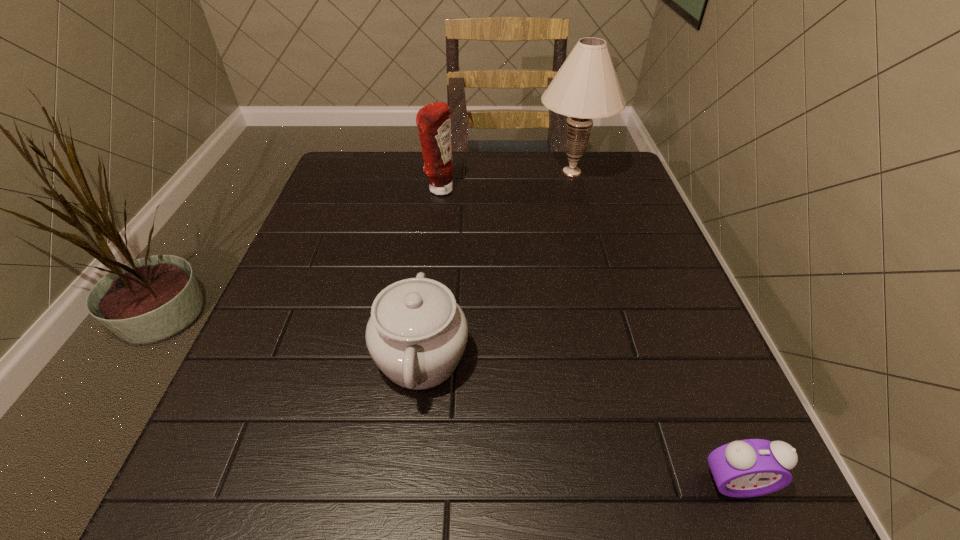
Locate an element on the screen. The height and width of the screenshot is (540, 960). the tallest object is located at coordinates (586, 87).

Find the location of a particular element. The height and width of the screenshot is (540, 960). condiment is located at coordinates (433, 120).

Image resolution: width=960 pixels, height=540 pixels. Find the location of `the second nearest object`. the second nearest object is located at coordinates (417, 333).

Find the location of a particular element. The height and width of the screenshot is (540, 960). chinaware is located at coordinates (417, 333).

Find the location of a particular element. the nearest object is located at coordinates (752, 467).

At what (x,y) coordinates should I click in order to perform the action: click on the shortest object. Please return your answer as a coordinate pair (x, y). This screenshot has height=540, width=960. Looking at the image, I should click on [x=752, y=467].

At what (x,y) coordinates should I click in order to perform the action: click on vacant space located 0.100m on the front of the tallest object. Please return your answer as a coordinate pair (x, y). Image resolution: width=960 pixels, height=540 pixels. Looking at the image, I should click on (585, 215).

Identify the location of free space located on the back of the third shortest object. tap(442, 169).

You are a GUI agent. You are given a task and a screenshot of the screen. Output one action in this format:
    pyautogui.click(x=<x>, y=<y>)
    Task: Click on the vacant space positioned on the left of the second nearest object
    The image size is (960, 540).
    Given the screenshot: What is the action you would take?
    pyautogui.click(x=276, y=357)

The width and height of the screenshot is (960, 540). Identify the location of lampshade that is positioned at the far edge. (586, 87).